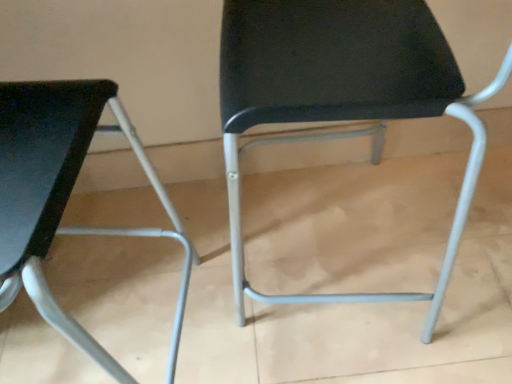
The width and height of the screenshot is (512, 384). Describe the element at coordinates (61, 194) in the screenshot. I see `matte black chair at left, the 2th chair in the right-to-left sequence` at that location.

Where is `matte black chair at left, the 2th chair in the right-to-left sequence`? This screenshot has width=512, height=384. matte black chair at left, the 2th chair in the right-to-left sequence is located at coordinates (61, 194).

Measure the distance between black fabric chair at center, acting as the 2th chair starting from the left, and camera.

The distance of black fabric chair at center, acting as the 2th chair starting from the left, from camera is 20.89 inches.

Describe the element at coordinates (341, 92) in the screenshot. The image size is (512, 384). I see `black fabric chair at center, acting as the 2th chair starting from the left` at that location.

Locate an element on the screen. This screenshot has width=512, height=384. black fabric chair at center, the 1th chair from the right is located at coordinates click(x=341, y=92).

Where is `matte black chair at left, which ranks as the first chair in left-to-right order`? This screenshot has width=512, height=384. matte black chair at left, which ranks as the first chair in left-to-right order is located at coordinates (61, 194).

Is matte black chair at left, the 2th chair in the right-to-left sequence, at the right side of black fabric chair at center, the 1th chair from the right?

No, matte black chair at left, the 2th chair in the right-to-left sequence, is not to the right of black fabric chair at center, the 1th chair from the right.

Consider the image. Between matte black chair at left, the 2th chair in the right-to-left sequence, and black fabric chair at center, the 1th chair from the right, which one is positioned in front?

matte black chair at left, the 2th chair in the right-to-left sequence, is closer to the camera.

Which is farther from the camera, (70, 182) or (397, 69)?

Positioned behind is point (397, 69).

From the image's perspective, which one is positioned higher, matte black chair at left, the 2th chair in the right-to-left sequence, or black fabric chair at center, the 1th chair from the right?

black fabric chair at center, the 1th chair from the right, appears higher in the image.

From a real-world perspective, is matte black chair at left, the 2th chair in the right-to-left sequence, above or below black fabric chair at center, the 1th chair from the right?

From a real-world perspective, matte black chair at left, the 2th chair in the right-to-left sequence, is physically above black fabric chair at center, the 1th chair from the right.

Considering the relative sizes of matte black chair at left, the 2th chair in the right-to-left sequence, and black fabric chair at center, the 1th chair from the right, in the image provided, is matte black chair at left, the 2th chair in the right-to-left sequence, wider than black fabric chair at center, the 1th chair from the right,?

Indeed, matte black chair at left, the 2th chair in the right-to-left sequence, has a greater width compared to black fabric chair at center, the 1th chair from the right.

Considering the sizes of matte black chair at left, which ranks as the first chair in left-to-right order, and black fabric chair at center, the 1th chair from the right, in the image, is matte black chair at left, which ranks as the first chair in left-to-right order, taller or shorter than black fabric chair at center, the 1th chair from the right,?

Clearly, matte black chair at left, which ranks as the first chair in left-to-right order, is taller compared to black fabric chair at center, the 1th chair from the right.

Who is bigger, matte black chair at left, the 2th chair in the right-to-left sequence, or black fabric chair at center, the 1th chair from the right?

matte black chair at left, the 2th chair in the right-to-left sequence, is bigger.

Looking at this image, would you say matte black chair at left, which ranks as the first chair in left-to-right order, is outside black fabric chair at center, acting as the 2th chair starting from the left?

Absolutely, matte black chair at left, which ranks as the first chair in left-to-right order, is external to black fabric chair at center, acting as the 2th chair starting from the left.

Is matte black chair at left, the 2th chair in the right-to-left sequence, next to black fabric chair at center, the 1th chair from the right?

matte black chair at left, the 2th chair in the right-to-left sequence, and black fabric chair at center, the 1th chair from the right, are not in contact.

Is matte black chair at left, the 2th chair in the right-to-left sequence, aimed at black fabric chair at center, the 1th chair from the right?

No, matte black chair at left, the 2th chair in the right-to-left sequence, does not turn towards black fabric chair at center, the 1th chair from the right.

Consider the image. Could you measure the distance between matte black chair at left, the 2th chair in the right-to-left sequence, and black fabric chair at center, the 1th chair from the right?

matte black chair at left, the 2th chair in the right-to-left sequence, and black fabric chair at center, the 1th chair from the right, are 11.58 inches apart.

This screenshot has height=384, width=512. I want to click on chair on the right of matte black chair at left, which ranks as the first chair in left-to-right order, so click(341, 92).

Is black fabric chair at center, acting as the 2th chair starting from the left, to the right of matte black chair at left, the 2th chair in the right-to-left sequence, from the viewer's perspective?

Yes, black fabric chair at center, acting as the 2th chair starting from the left, is to the right of matte black chair at left, the 2th chair in the right-to-left sequence.

Who is more distant, black fabric chair at center, the 1th chair from the right, or matte black chair at left, the 2th chair in the right-to-left sequence?

black fabric chair at center, the 1th chair from the right, is more distant.

Which is in front, point (288, 49) or point (22, 161)?

Point (22, 161)

From the image's perspective, which is above, black fabric chair at center, the 1th chair from the right, or matte black chair at left, the 2th chair in the right-to-left sequence?

black fabric chair at center, the 1th chair from the right, appears higher in the image.

From a real-world perspective, which object rests below the other?

From a 3D spatial view, black fabric chair at center, acting as the 2th chair starting from the left, is below.

Does black fabric chair at center, acting as the 2th chair starting from the left, have a greater width compared to matte black chair at left, which ranks as the first chair in left-to-right order?

No, black fabric chair at center, acting as the 2th chair starting from the left, is not wider than matte black chair at left, which ranks as the first chair in left-to-right order.

From their relative heights in the image, would you say black fabric chair at center, acting as the 2th chair starting from the left, is taller or shorter than matte black chair at left, which ranks as the first chair in left-to-right order?

In the image, black fabric chair at center, acting as the 2th chair starting from the left, appears to be shorter than matte black chair at left, which ranks as the first chair in left-to-right order.

Consider the image. Which of these two, black fabric chair at center, acting as the 2th chair starting from the left, or matte black chair at left, the 2th chair in the right-to-left sequence, is smaller?

With smaller size is black fabric chair at center, acting as the 2th chair starting from the left.

Is black fabric chair at center, the 1th chair from the right, located outside matte black chair at left, the 2th chair in the right-to-left sequence?

Yes.

Is black fabric chair at center, the 1th chair from the right, not close to matte black chair at left, the 2th chair in the right-to-left sequence?

No, there isn't a large distance between black fabric chair at center, the 1th chair from the right, and matte black chair at left, the 2th chair in the right-to-left sequence.

Is black fabric chair at center, the 1th chair from the right, turned away from matte black chair at left, the 2th chair in the right-to-left sequence?

That's not correct — black fabric chair at center, the 1th chair from the right, is not looking away from matte black chair at left, the 2th chair in the right-to-left sequence.

Could you measure the distance between black fabric chair at center, acting as the 2th chair starting from the left, and matte black chair at left, which ranks as the first chair in left-to-right order?

black fabric chair at center, acting as the 2th chair starting from the left, is 11.58 inches away from matte black chair at left, which ranks as the first chair in left-to-right order.

Find the location of a particular element. Image resolution: width=512 pixels, height=384 pixels. chair on the right of matte black chair at left, the 2th chair in the right-to-left sequence is located at coordinates click(x=341, y=92).

Locate an element on the screen. The height and width of the screenshot is (384, 512). chair located on the left of black fabric chair at center, acting as the 2th chair starting from the left is located at coordinates (61, 194).

Where is `chair below the black fabric chair at center, the 1th chair from the right (from the image's perspective)`? Image resolution: width=512 pixels, height=384 pixels. chair below the black fabric chair at center, the 1th chair from the right (from the image's perspective) is located at coordinates pos(61,194).